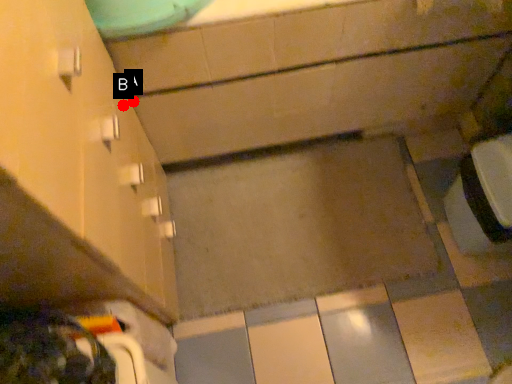
Question: Two points are circled on the image, labeled by A and B beside each circle. Which point is further to the camera?

Choices:
 (A) A is further
 (B) B is further

Answer: (A)